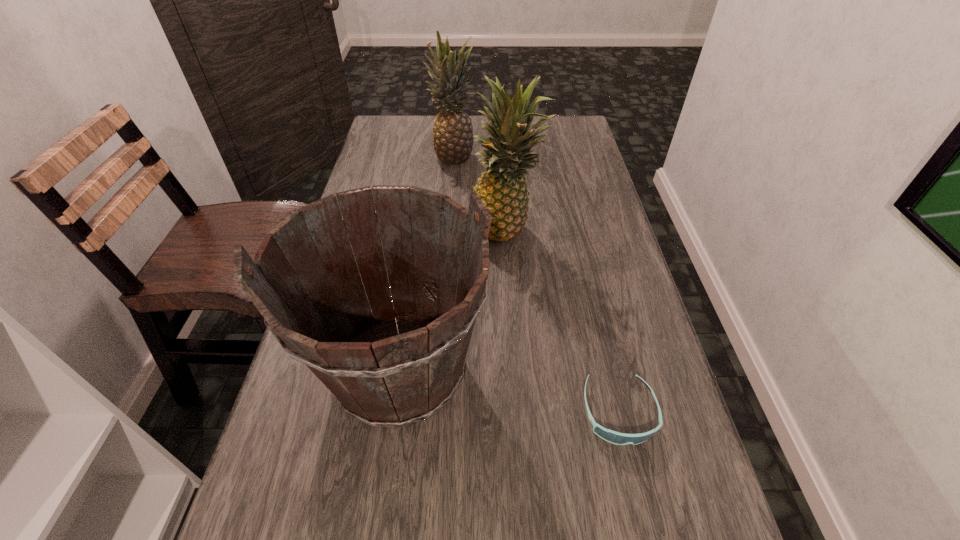
Locate an element on the screen. Image resolution: width=960 pixels, height=540 pixels. free space located on the front-facing side of the shortest object is located at coordinates (645, 526).

The width and height of the screenshot is (960, 540). I want to click on object that is at the far edge, so click(453, 140).

At what (x,y) coordinates should I click in order to perform the action: click on bucket that is at the left edge. Please return your answer as a coordinate pair (x, y). This screenshot has height=540, width=960. Looking at the image, I should click on [394, 367].

In order to click on Lego at the left edge in this screenshot , I will do pyautogui.click(x=342, y=217).

Find the location of a particular element. This screenshot has width=960, height=540. object that is at the right edge is located at coordinates [x=611, y=436].

The height and width of the screenshot is (540, 960). I want to click on free space at the left edge, so click(x=365, y=431).

At what (x,y) coordinates should I click in order to perform the action: click on vacant space at the right edge of the desktop. Please return your answer as a coordinate pair (x, y). Looking at the image, I should click on (585, 196).

Find the location of a particular element. This screenshot has height=540, width=960. vacant space at the far left corner is located at coordinates (396, 147).

Where is `blank space at the far right corner`? blank space at the far right corner is located at coordinates tap(565, 148).

This screenshot has width=960, height=540. I want to click on vacant space that is in between the nearer pineapple and the rightmost object, so click(563, 322).